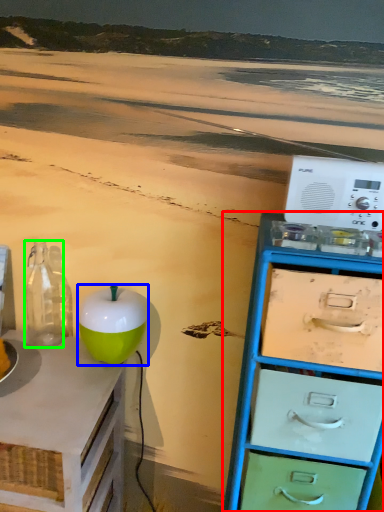
Question: Estimate the real-world distances between objects in this image. Which object is closer to chest of drawers (highlighted by a red box), teal (highlighted by a blue box) or bottle (highlighted by a green box)?

Choices:
 (A) teal
 (B) bottle

Answer: (A)